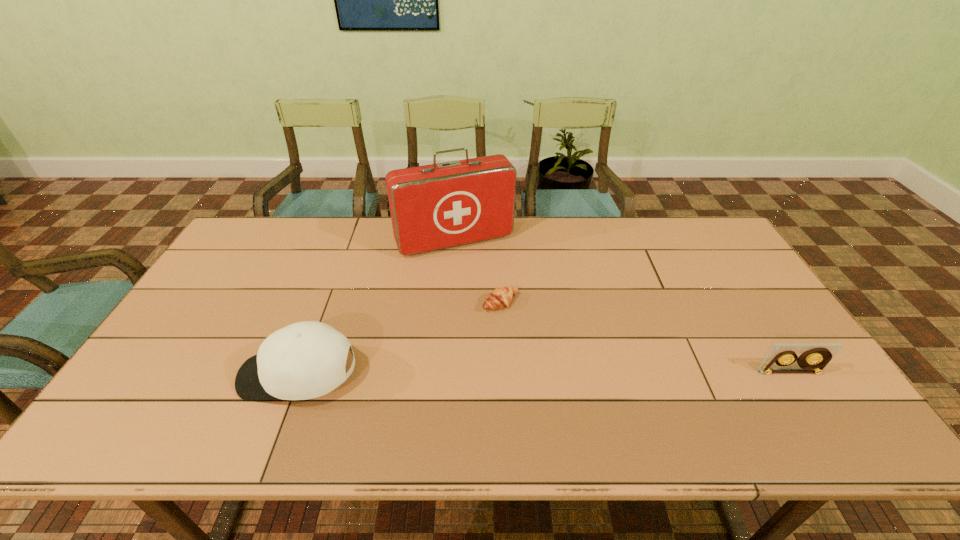
This screenshot has height=540, width=960. What are the coordinates of `the leftmost object` in the screenshot? It's located at (305, 360).

This screenshot has height=540, width=960. What are the coordinates of `baseball cap` in the screenshot? It's located at (305, 360).

Image resolution: width=960 pixels, height=540 pixels. Find the location of `the rightmost object`. the rightmost object is located at coordinates (814, 357).

Image resolution: width=960 pixels, height=540 pixels. Find the location of `videotape`. videotape is located at coordinates (814, 357).

You are a GUI agent. You are given a task and a screenshot of the screen. Output one action in this format:
    pyautogui.click(x=<x>, y=<y>)
    Task: Click on the first-aid kit
    The image size is (960, 540).
    Given the screenshot: What is the action you would take?
    pyautogui.click(x=436, y=206)

Locate an element on the screen. The width and height of the screenshot is (960, 540). the farthest object is located at coordinates (436, 206).

At what (x,y) coordinates should I click in order to perform the action: click on the shortest object. Please return your answer as a coordinate pair (x, y). The height and width of the screenshot is (540, 960). Looking at the image, I should click on (499, 298).

Where is `the second farthest object`? This screenshot has height=540, width=960. the second farthest object is located at coordinates (499, 298).

In order to click on vacant region located on the front-facing side of the leftmost object in this screenshot , I will do `click(168, 375)`.

This screenshot has width=960, height=540. I want to click on vacant space situated on the front-facing side of the leftmost object, so click(159, 375).